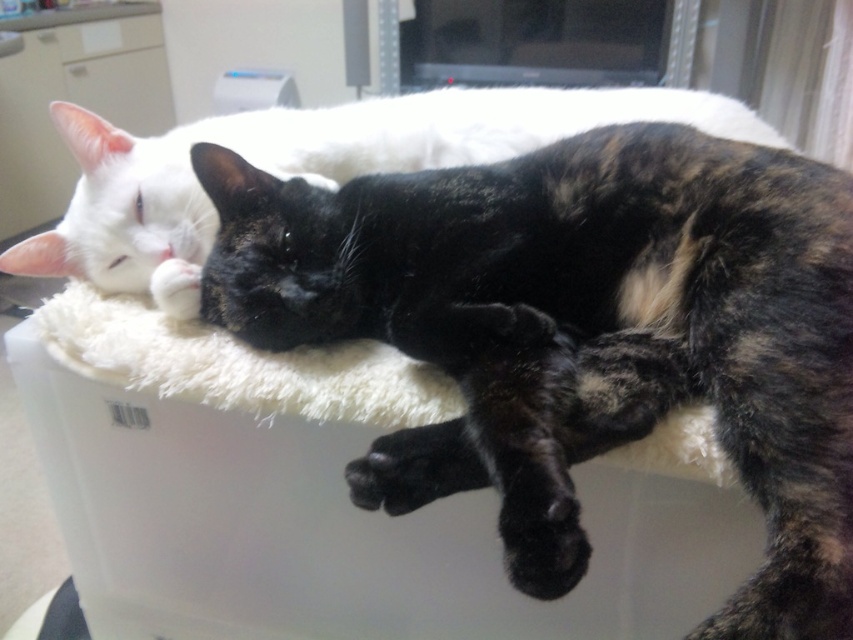
You are a photographer trying to capture a closeup shot of the white fluffy cat at upper center. The camera you are using has a focal length of 50mm. Based on the coordinates provided, can you determine if the cat is positioned within the frame of a standard 35mm camera sensor? The sensor measures 24mm in width and 36mm in height.

The white fluffy cat at upper center is located at coordinates point (306,166). Since these coordinates are within the 0 to 1 range, the cat is positioned within the frame of a standard 35mm camera sensor.

You are a photographer trying to capture a closeup of the white fluffy cat at upper center without disturbing it. You are currently standing in front of the white fluffy cat bed at center. Can you move forward to get closer to the cat?

The white fluffy cat bed at center is behind the white fluffy cat at upper center, so you can move forward to get closer to the cat as the bed is not blocking your path.

You are a photographer trying to capture a closeup of the white fluffy cat bed at center. You notice the white fluffy cat at upper center is blocking your view. Which direction should you move your camera to get the bed into frame without moving the cats?

The white fluffy cat at upper center is positioned on the right side of the white fluffy cat bed at center, so you should move your camera to the left to get the bed into frame without moving the cats.